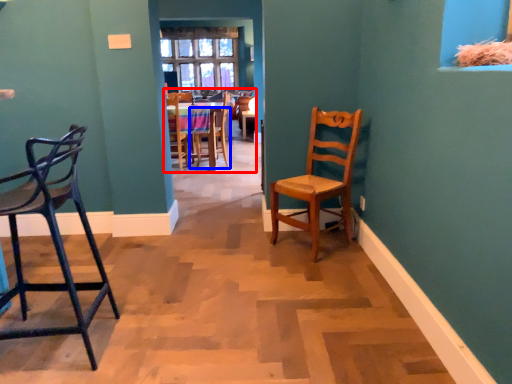
Question: Which point is closer to the camera, chair (highlighted by a red box) or chair (highlighted by a blue box)?

Choices:
 (A) chair
 (B) chair

Answer: (A)